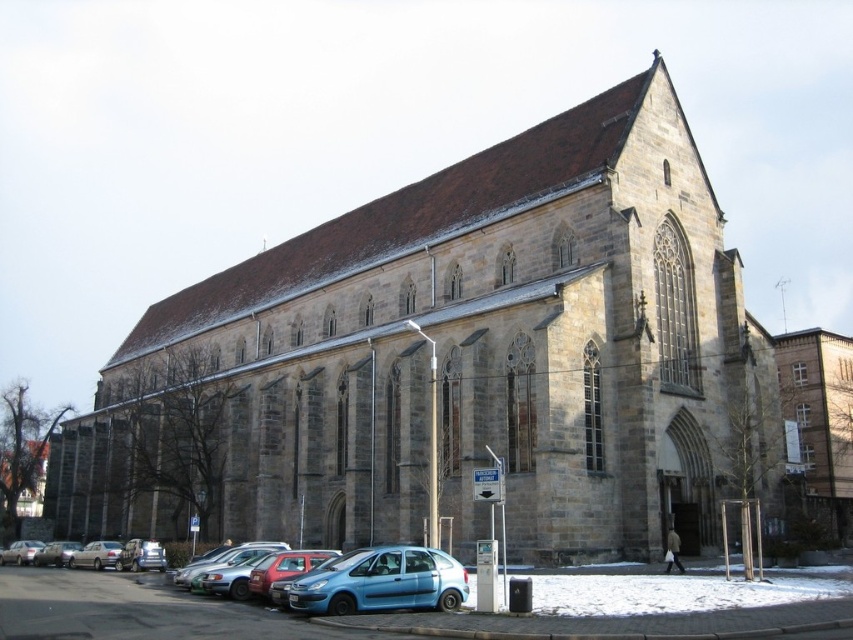
Question: Can you confirm if stone church at center is bigger than blue matte hatchback at lower center?

Choices:
 (A) yes
 (B) no

Answer: (A)

Question: Which point appears farthest from the camera in this image?

Choices:
 (A) (631, 163)
 (B) (3, 557)
 (C) (73, 563)

Answer: (B)

Question: Among these points, which one is farthest from the camera?

Choices:
 (A) (109, 560)
 (B) (489, 243)
 (C) (36, 547)
 (D) (54, 561)

Answer: (C)

Question: Can you confirm if blue matte hatchback at lower center is thinner than silver metallic sedan at lower left?

Choices:
 (A) no
 (B) yes

Answer: (A)

Question: Among these points, which one is nearest to the camera?

Choices:
 (A) (730, 426)
 (B) (93, 547)
 (C) (39, 554)

Answer: (A)

Question: Is blue matte hatchback at lower center smaller than silver metallic sedan at lower left?

Choices:
 (A) yes
 (B) no

Answer: (A)